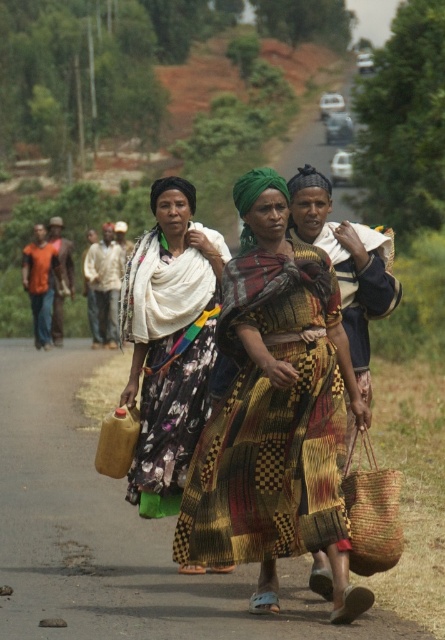
Describe the element at coordinates (170, 337) in the screenshot. Image resolution: width=445 pixels, height=640 pixels. I see `floral fabric dress at center` at that location.

Can you confirm if floral fabric dress at center is smaller than braided straw basket at center?

No, floral fabric dress at center is not smaller than braided straw basket at center.

Describe the element at coordinates (170, 337) in the screenshot. I see `floral fabric dress at center` at that location.

Where is `floral fabric dress at center`? floral fabric dress at center is located at coordinates (170, 337).

Which of these two, multicolored woven dress at center or braided straw basket at center, stands taller?

braided straw basket at center

Looking at this image, does multicolored woven dress at center have a greater width compared to braided straw basket at center?

Indeed, multicolored woven dress at center has a greater width compared to braided straw basket at center.

Does point (287, 426) come closer to viewer compared to point (385, 248)?

Yes, it is in front of point (385, 248).

Image resolution: width=445 pixels, height=640 pixels. What are the coordinates of `multicolored woven dress at center` in the screenshot? It's located at (271, 422).

Between multicolored woven dress at center and floral fabric dress at center, which one appears on the left side from the viewer's perspective?

floral fabric dress at center is more to the left.

Does multicolored woven dress at center appear on the right side of floral fabric dress at center?

Yes, multicolored woven dress at center is to the right of floral fabric dress at center.

Measure the distance between multicolored woven dress at center and camera.

They are 22.51 feet apart.

This screenshot has height=640, width=445. Identify the location of multicolored woven dress at center. (271, 422).